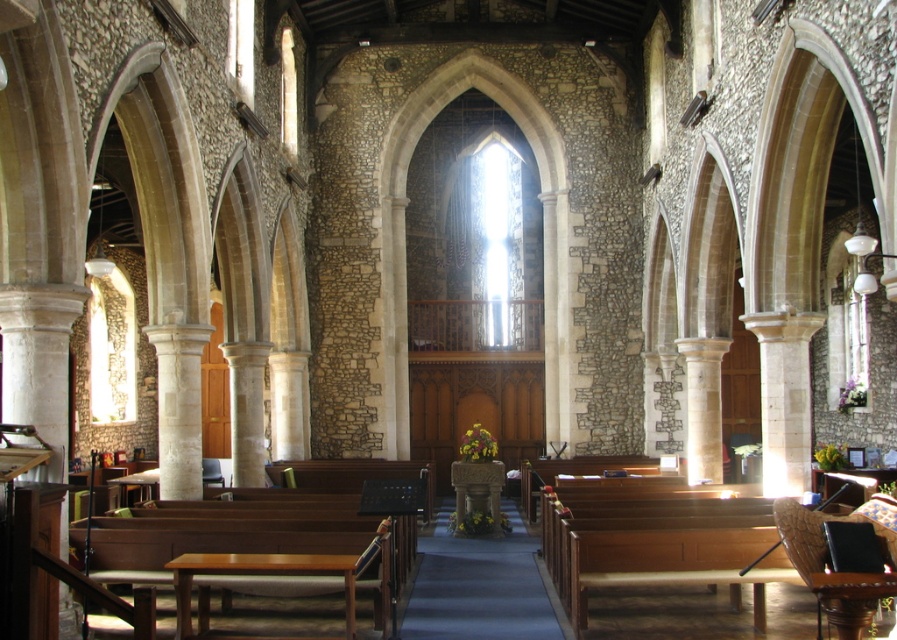
Question: Is wooden polished bench at lower right wider than leather cushioned chair at lower right?

Choices:
 (A) yes
 (B) no

Answer: (A)

Question: Is wooden polished bench at lower right behind leather cushioned chair at lower right?

Choices:
 (A) yes
 (B) no

Answer: (A)

Question: Which object appears closest to the camera in this image?

Choices:
 (A) leather cushioned chair at lower right
 (B) wooden polished bench at lower right

Answer: (A)

Question: Which point appears closest to the camera in this image?

Choices:
 (A) (839, 611)
 (B) (629, 525)

Answer: (A)

Question: Is wooden polished bench at lower right below leather cushioned chair at lower right?

Choices:
 (A) yes
 (B) no

Answer: (A)